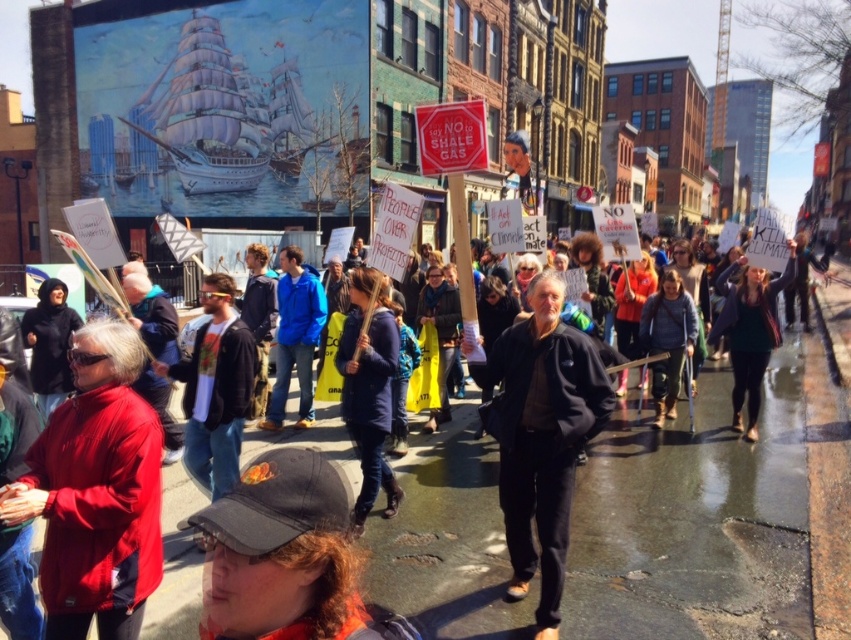
Is red softshell jacket at lower left thinner than dark gray sweater at center?

Indeed, red softshell jacket at lower left has a lesser width compared to dark gray sweater at center.

Between point (132, 620) and point (717, 316), which one is positioned in front?

Point (132, 620) is in front.

Between point (64, 483) and point (762, 378), which one is positioned behind?

Positioned behind is point (762, 378).

You are a GUI agent. You are given a task and a screenshot of the screen. Output one action in this format:
    pyautogui.click(x=<x>, y=<y>)
    Task: Click on the red softshell jacket at lower left
    
    Given the screenshot: What is the action you would take?
    pyautogui.click(x=96, y=492)

Between red softshell jacket at lower left and blue denim jacket at center, which one is positioned higher?

blue denim jacket at center is above.

Which is behind, point (49, 554) or point (358, 365)?

The point (358, 365) is more distant.

Locate an element on the screen. red softshell jacket at lower left is located at coordinates (96, 492).

Which is behind, point (370, 304) or point (734, 355)?

Positioned behind is point (734, 355).

Between blue denim jacket at center and dark gray sweater at center, which one appears on the left side from the viewer's perspective?

blue denim jacket at center is more to the left.

Who is more distant from viewer, (386, 291) or (757, 384)?

The point (757, 384) is behind.

Find the location of a particular element. The height and width of the screenshot is (640, 851). blue denim jacket at center is located at coordinates (369, 385).